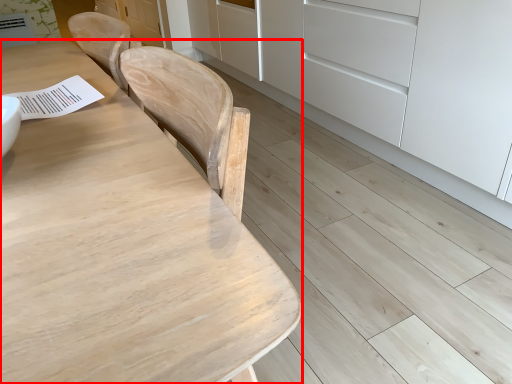
Question: Observing the image, what is the correct spatial positioning of table (annotated by the red box) in reference to cabinetry?

Choices:
 (A) right
 (B) left

Answer: (B)